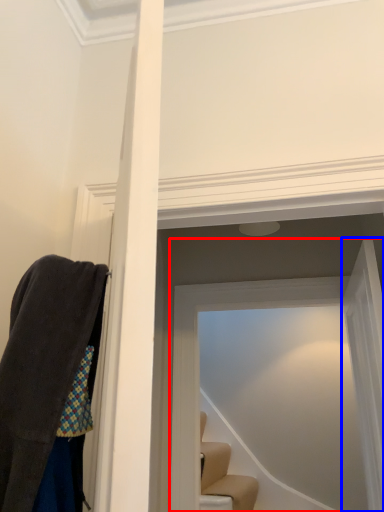
Question: Which object appears closest to the camera in this image, glass door (highlighted by a red box) or glass door (highlighted by a blue box)?

Choices:
 (A) glass door
 (B) glass door

Answer: (B)